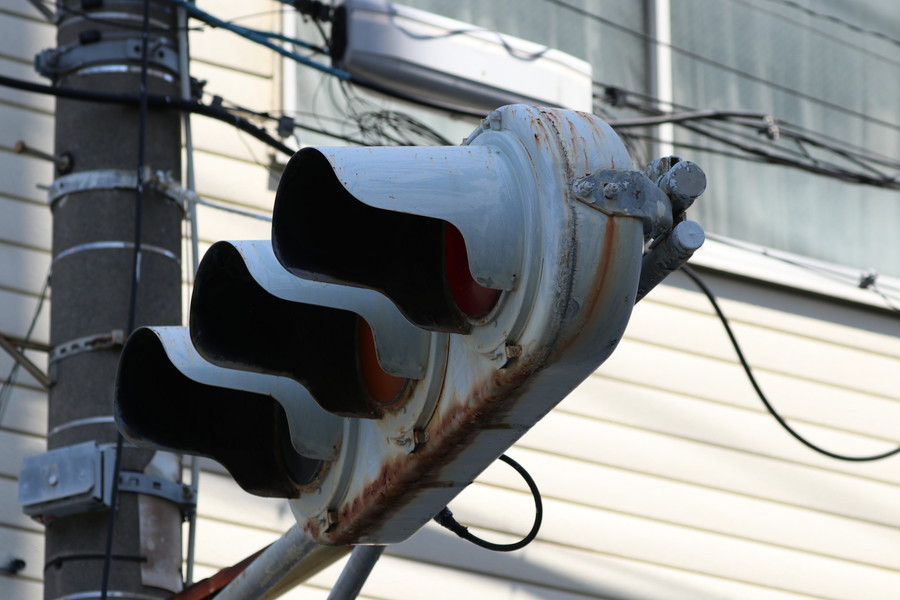
Where is `cord`? Image resolution: width=900 pixels, height=600 pixels. cord is located at coordinates 729,335.